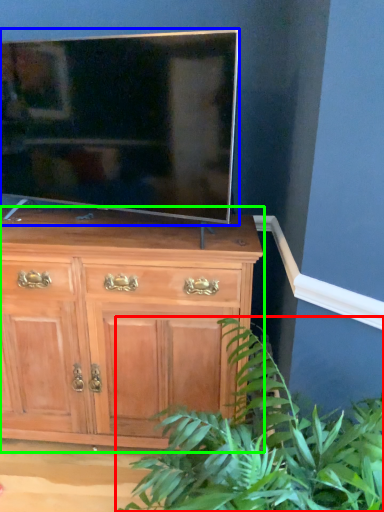
Question: Which object is positioned farthest from houseplant (highlighted by a red box)? Select from television (highlighted by a blue box) and chest of drawers (highlighted by a green box).

Choices:
 (A) television
 (B) chest of drawers

Answer: (A)